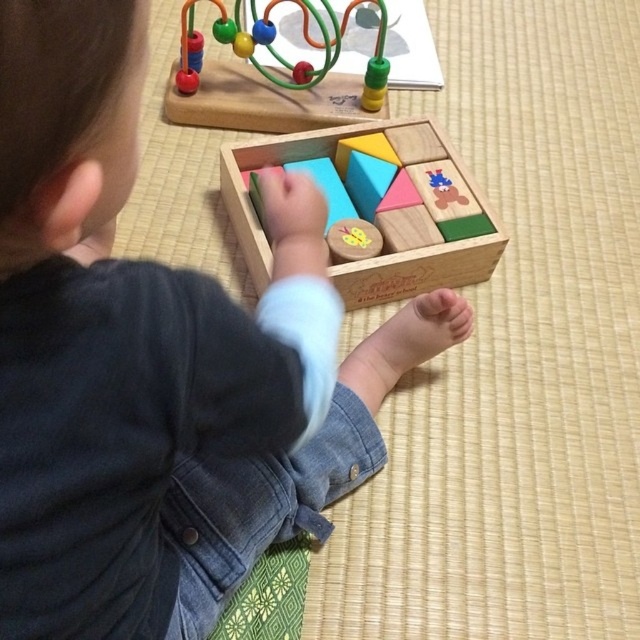
Question: Can you confirm if denim jacket at lower center is positioned above wooden block set at center?

Choices:
 (A) no
 (B) yes

Answer: (A)

Question: Which of the following is the farthest from the observer?

Choices:
 (A) denim jacket at lower center
 (B) wooden bead maze at upper center
 (C) wooden block set at center

Answer: (B)

Question: Which point is farther from the camera taking this photo?

Choices:
 (A) (88, 401)
 (B) (403, 280)
 (C) (264, 88)

Answer: (C)

Question: Which point appears farthest from the camera in this image?

Choices:
 (A) (362, 292)
 (B) (68, 285)

Answer: (A)

Question: Can you confirm if wooden bead maze at upper center is wider than wooden block set at center?

Choices:
 (A) yes
 (B) no

Answer: (B)

Question: Is denim jacket at lower center smaller than wooden block set at center?

Choices:
 (A) yes
 (B) no

Answer: (B)